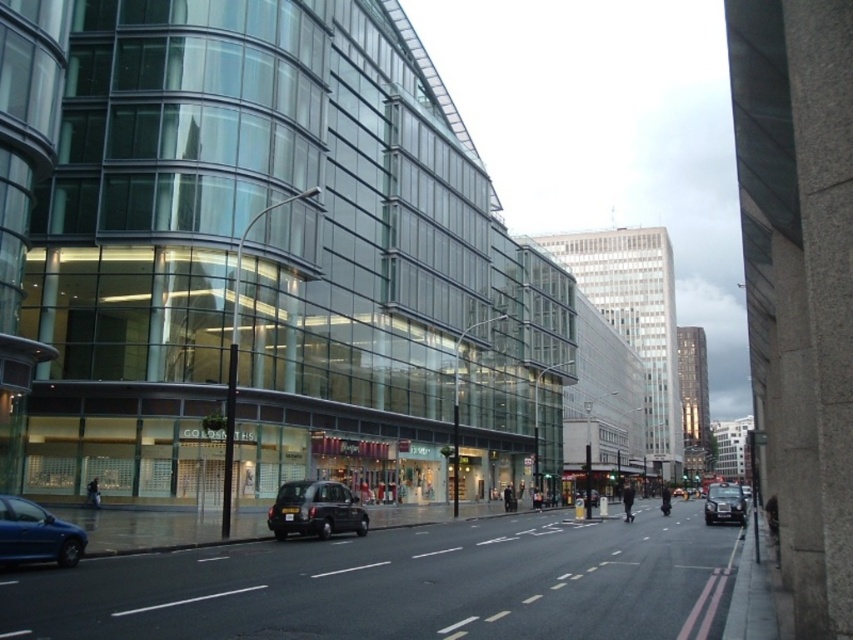
You are a pedestrian standing at the crosswalk on the right side of the street. You want to cross to the left side where the modern glass building is. Which vehicle, the black matte taxi at center or the metallic blue car at lower left, is closer to your starting position?

The metallic blue car at lower left is closer to your starting position because the black matte taxi at center is to the right of it, meaning the metallic blue car is positioned between you and the taxi.

You are a delivery drone flying over the urban street scene. You need to land precisely on the black matte taxi at center. What are the coordinates where you should aim to land?

The coordinates for the black matte taxi at center are at point (x=315, y=509), so you should aim to land there.

You are standing on the sidewalk of this urban street scene and want to cross the road to reach the modern glass building. The crosswalk is 25 meters away. Can you safely reach the crosswalk before the black matte taxi at center, which is 22.67 meters away from you, arrives at the crosswalk?

The black matte taxi at center is only 22.67 meters away from you, which is closer than the 25 meters to the crosswalk. This means the taxi will reach the crosswalk before you, so it is not safe to attempt crossing at this moment.